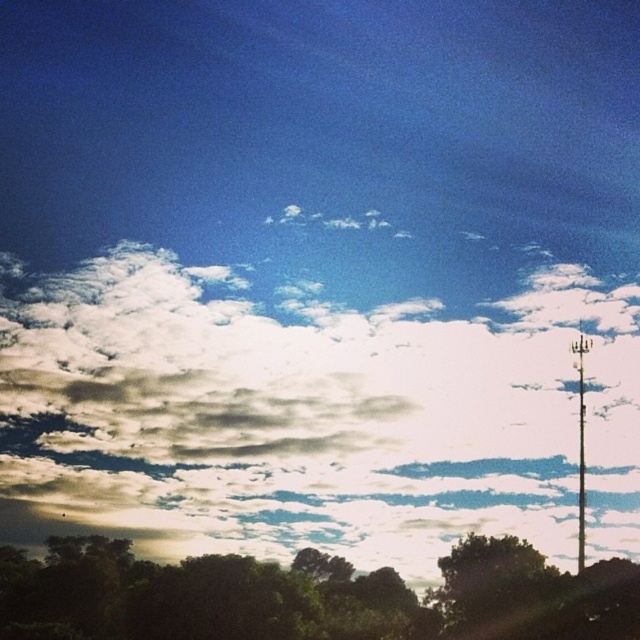
Is white fluffy cloud at upper center below green leafy tree at lower center?

Incorrect, white fluffy cloud at upper center is not positioned below green leafy tree at lower center.

Is white fluffy cloud at upper center taller than green leafy tree at lower center?

Yes.

Does point (586, 410) lie behind point (131, 573)?

That is True.

The width and height of the screenshot is (640, 640). Identify the location of white fluffy cloud at upper center. (308, 417).

Which is behind, point (156, 632) or point (579, 493)?

The point (579, 493) is behind.

Which is in front, point (314, 566) or point (580, 344)?

Point (314, 566) is more forward.

Which is in front, point (483, 550) or point (576, 365)?

Positioned in front is point (483, 550).

Where is `green leafy tree at lower center`? The height and width of the screenshot is (640, 640). green leafy tree at lower center is located at coordinates (308, 596).

Who is taller, white fluffy cloud at upper center or metallic pole at right?

white fluffy cloud at upper center

Is white fluffy cloud at upper center thinner than metallic pole at right?

No.

Between point (74, 497) and point (582, 381), which one is positioned behind?

Point (74, 497)

In order to click on white fluffy cloud at upper center in this screenshot , I will do `click(308, 417)`.